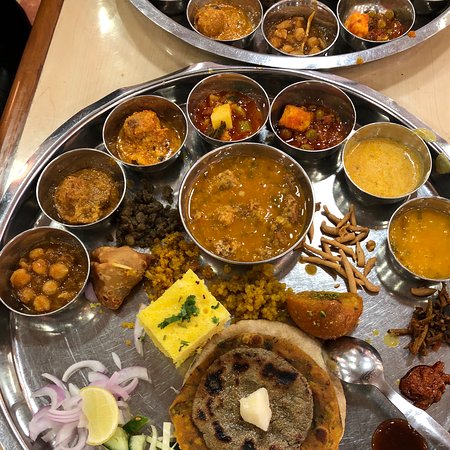
This screenshot has height=450, width=450. In order to click on the left side of table in this screenshot , I will do `click(25, 93)`.